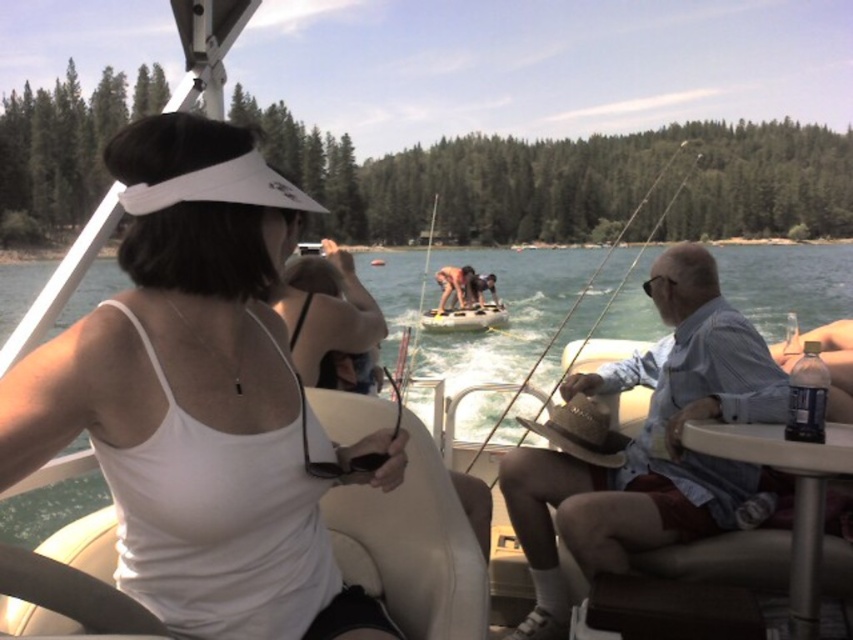
You are a photographer trying to capture the white matte visor at upper left and the rubber dinghy at center in the same frame. Based on their positions, which object is closer to the bottom edge of the photo?

The white matte visor at upper left is below the rubber dinghy at center, so it is closer to the bottom edge of the photo.

You are a photographer trying to capture a photo of the light blue denim shirt at right and the rubber dinghy at center. Which object should you focus on first if you want to include both in your shot without moving the camera?

The light blue denim shirt at right is positioned on the left side of the rubber dinghy at center, so you should focus on the light blue denim shirt at right first to ensure both are in frame.

You are a photographer trying to capture a clear shot of the white matte visor at upper left and the light blue denim shirt at right. Since you want to focus on the visor, which object should you adjust the camera focus on first?

The white matte visor at upper left is shorter than the light blue denim shirt at right, so you should focus on the light blue denim shirt at right first because it is farther away and requires precise focusing.